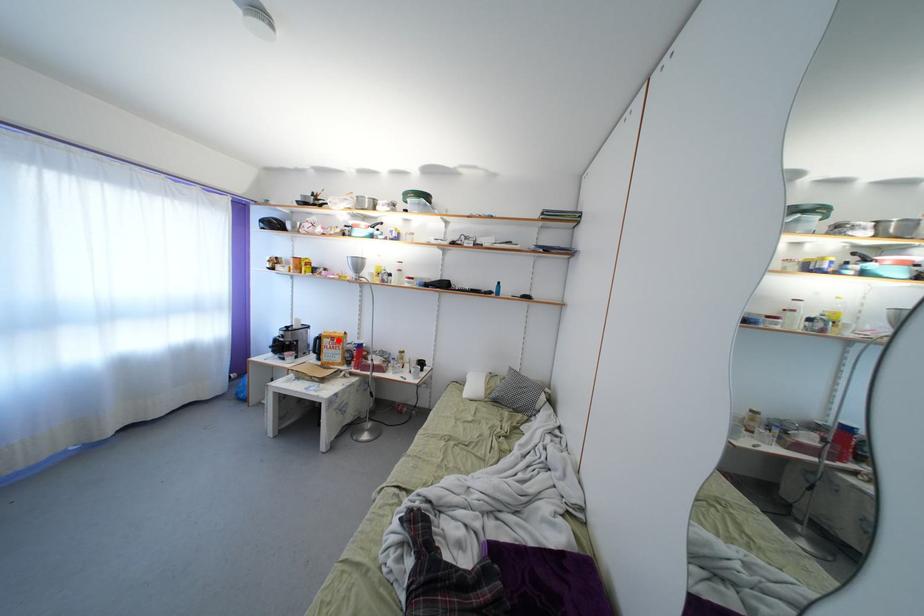
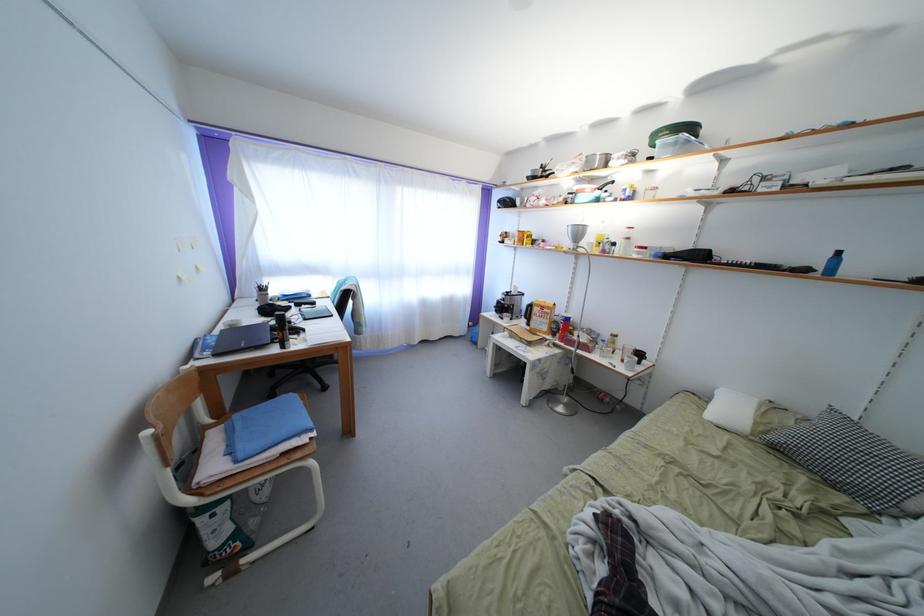
In the second image, find the point that corresponds to the highlighted location in the first image.

(549, 310)